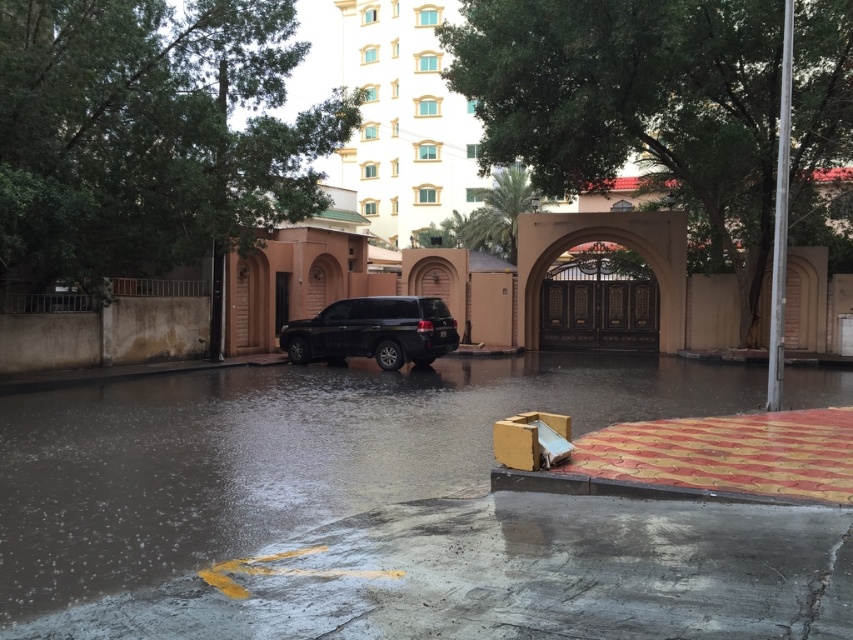
You are a delivery driver trying to navigate through the flooded street. You see the white glossy building at upper center and the black matte suv at center. Which object is closer to you as you drive towards them?

The white glossy building at upper center is closer to you than the black matte suv at center because it is positioned further to the viewer, meaning it appears nearer in the scene.

You are a delivery drone with a maximum flight range of 30 meters. You need to deliver a package from the white glossy building at upper center to the brown polished wood archway at center. Can you complete the delivery without needing a recharge?

The distance between the white glossy building at upper center and the brown polished wood archway at center is 28.89 meters, which is within your 30 meter range. Yes, you can complete the delivery without needing a recharge.